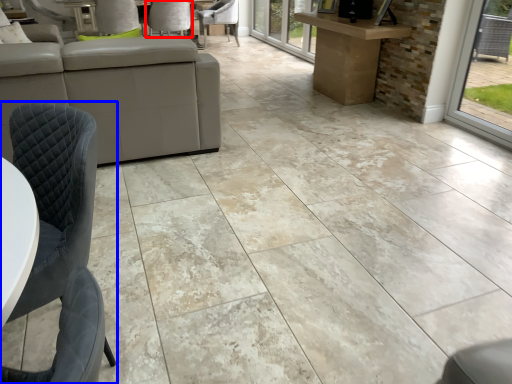
Question: Among these objects, which one is farthest to the camera, chair (highlighted by a red box) or chair (highlighted by a blue box)?

Choices:
 (A) chair
 (B) chair

Answer: (A)